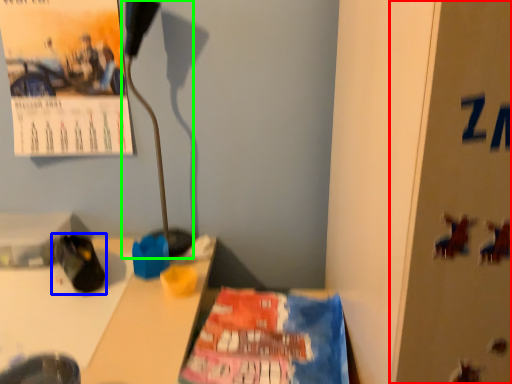
Question: Which object is the closest to the bulletin board (highlighted by a red box)? Choose among these: footwear (highlighted by a blue box) or lamp (highlighted by a green box).

Choices:
 (A) footwear
 (B) lamp

Answer: (A)